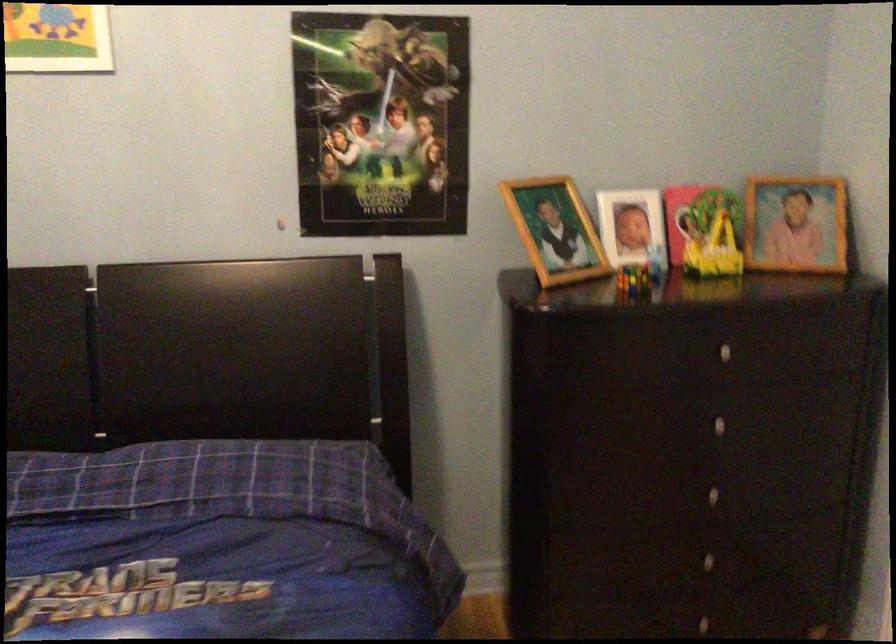
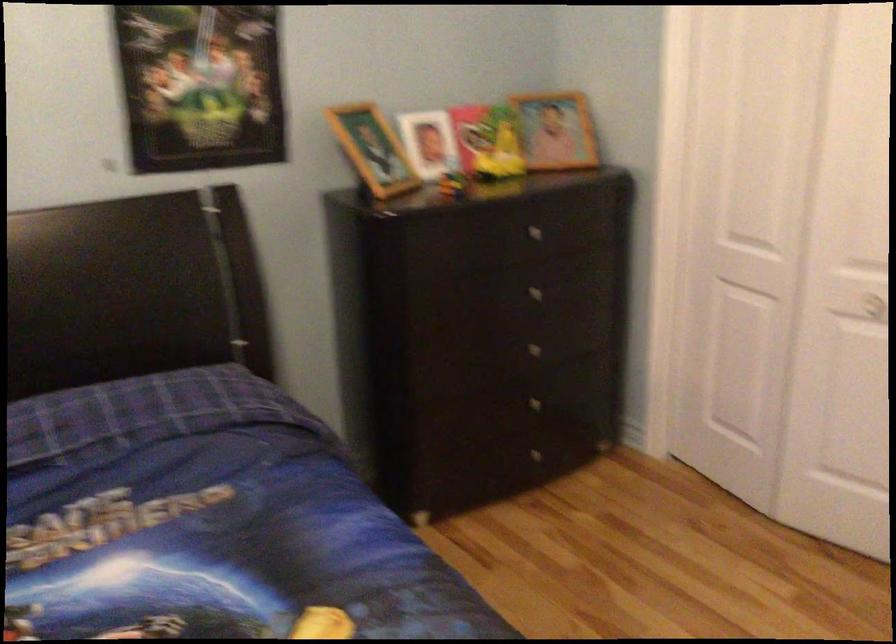
Where in the second image is the point corresponding to [719,348] from the first image?

(530, 230)